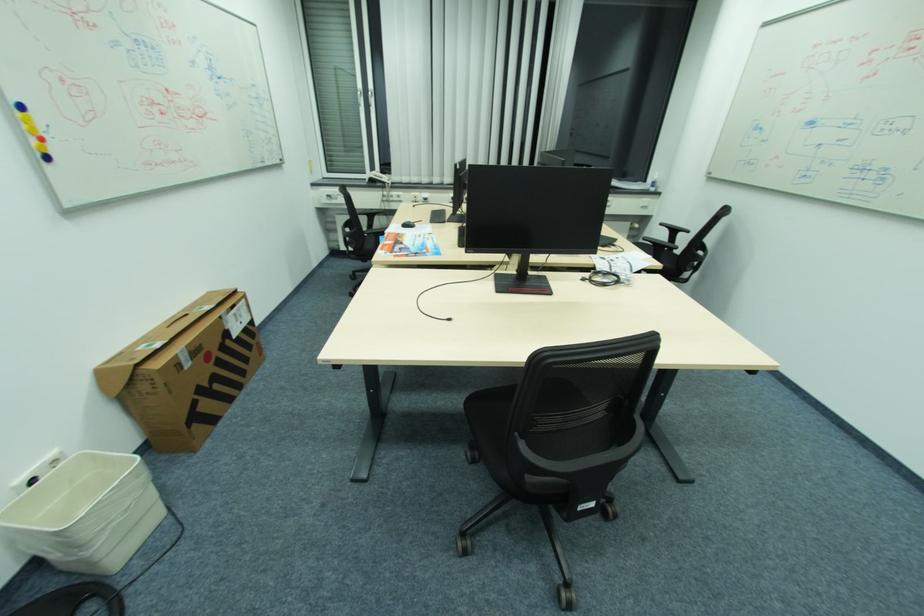
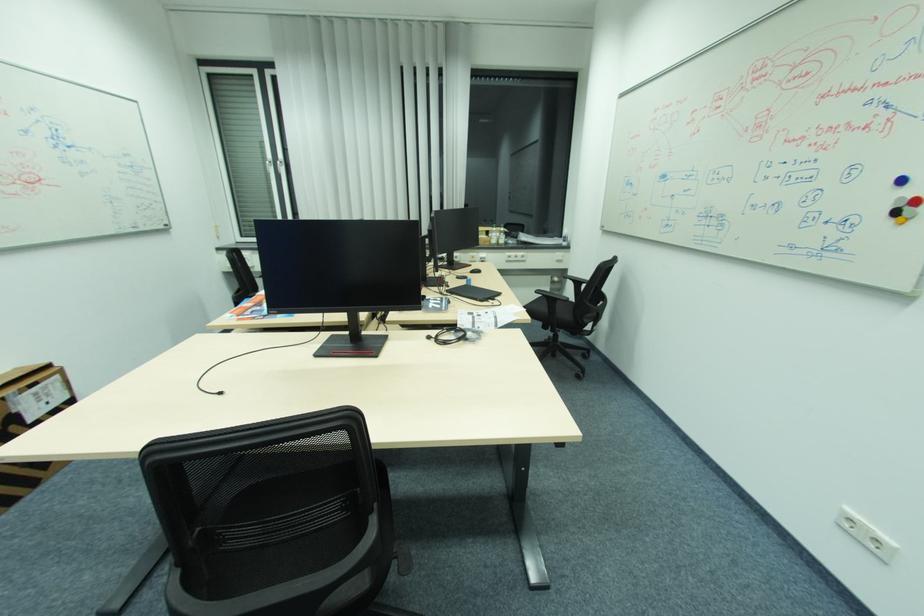
In the second image, find the point that corresponds to [678,232] in the first image.

(584, 283)